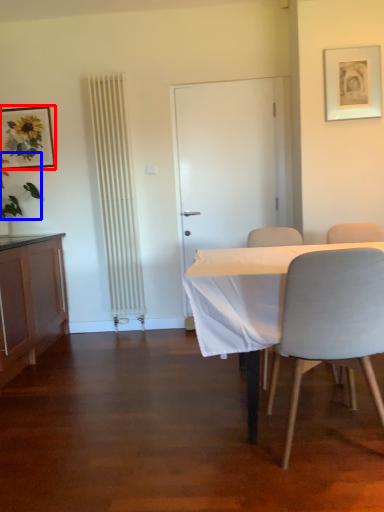
Question: Which point is further to the camera, picture frame (highlighted by a red box) or plant (highlighted by a blue box)?

Choices:
 (A) picture frame
 (B) plant

Answer: (A)